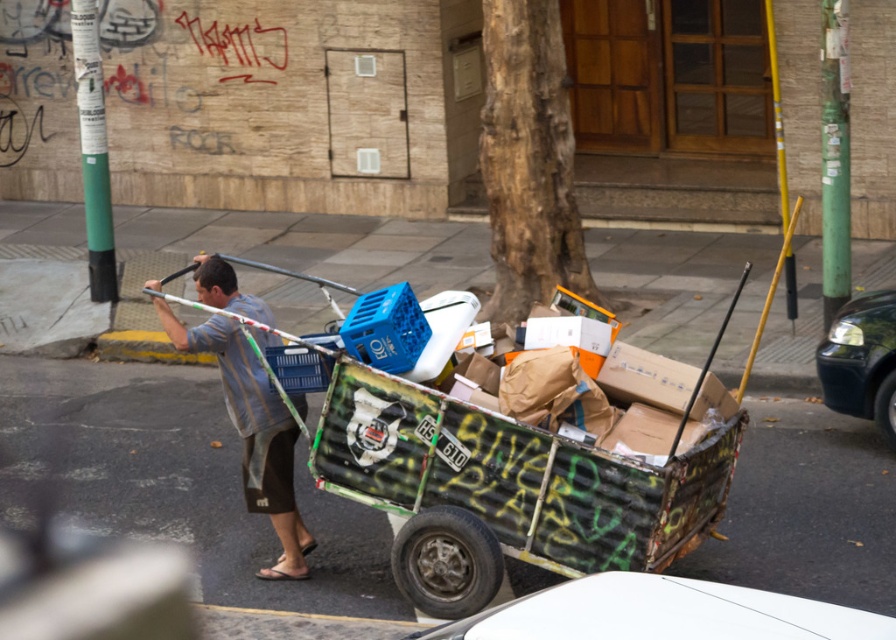
You are a delivery person who needs to park your vehicle in a spot that is exactly 2 meters wide. You see a white matte car at lower center and a shiny black car at right. Which car, if either, can fit into the parking space without needing to adjust its position?

The white matte car at lower center might be wider than shiny black car at right, so it is uncertain if it can fit. The shiny black car at right is narrower, so it can fit into the 2 meter parking space.

You are a pedestrian trying to cross the street and see the rusty corrugated cart at center and the white matte car at lower center. Which object is closer to you?

The rusty corrugated cart at center is closer to you because it is further to the viewer than the white matte car at lower center.

You are a delivery person who needs to park your vehicle in a tight alleyway. The alleyway can only accommodate vehicles that are smaller than the white matte car at lower center. Can you park your rusty corrugated cart at center there?

The rusty corrugated cart at center has a larger size compared to the white matte car at lower center. Since the alleyway can only accommodate vehicles smaller than the white matte car at lower center, the rusty corrugated cart at center cannot be parked there due to its larger size.